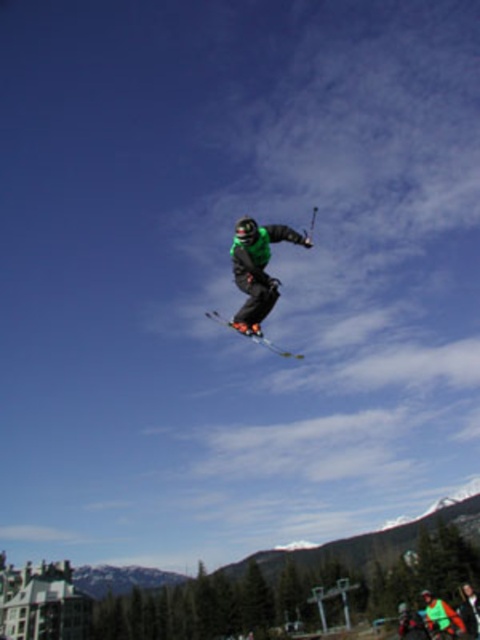
Based on the photo, you are a drone operator trying to capture the perfect shot of the green matte snowboarder at center. The drone is currently at point A located at coordinates 0.3, 0.5. To get the best angle, you need to move the drone to a position that is 0.1 units to the right and 0.05 units higher than the snowboarder. What are the new coordinates where you should position the drone?

The green matte snowboarder at center is at point (x=257, y=268). Moving 0.1 units to the right adds 0.1 to the x coordinate, and moving 0.05 units higher adds 0.05 to the y coordinate. The new coordinates would be (x=281, y=332).

You are a photographer trying to capture a closeup shot of the green matte snowboarder at center and the shiny black skis at center. Which object should you zoom in on to ensure it appears wider in your photo?

The shiny black skis at center are wider than the green matte snowboarder at center, so you should zoom in on the shiny black skis at center to make it appear wider in the photo.

You are a photographer trying to capture the perfect shot of the green matte snowboarder at center and the shiny black skis at center. Given their sizes, which object should you zoom in on to ensure both are clearly visible in the frame?

The green matte snowboarder at center has a smaller size compared to the shiny black skis at center. To ensure both are clearly visible, you should zoom in on the shiny black skis at center since they are larger and will remain in focus even when zoomed in, allowing the smaller snowboarder to still be visible in the frame.